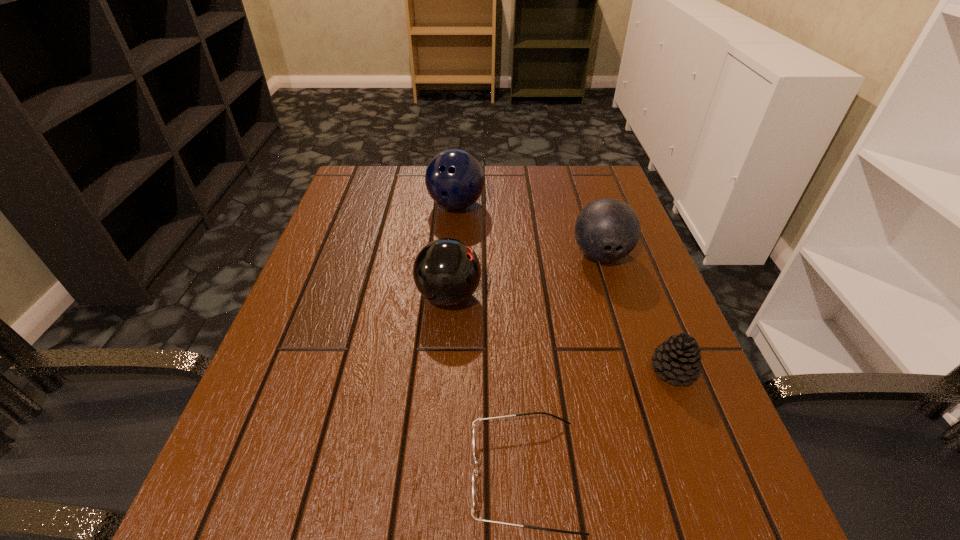
Identify the location of the farthest bowling ball. (455, 179).

You are a GUI agent. You are given a task and a screenshot of the screen. Output one action in this format:
    pyautogui.click(x=<x>, y=<y>)
    Task: Click on the rightmost bowling ball
    
    Given the screenshot: What is the action you would take?
    pyautogui.click(x=607, y=229)

Image resolution: width=960 pixels, height=540 pixels. Identify the location of the fourth farthest object. (678, 358).

Find the location of a particular element. The height and width of the screenshot is (540, 960). the fourth tallest object is located at coordinates (678, 358).

At what (x,y) coordinates should I click in order to perform the action: click on spectacles. Please return your answer as a coordinate pair (x, y). Looking at the image, I should click on coord(475,471).

The width and height of the screenshot is (960, 540). What are the coordinates of `the nearest object` in the screenshot? It's located at (475, 471).

The height and width of the screenshot is (540, 960). Find the location of `vacant space situated on the surface of the farthest object near the finger holes`. vacant space situated on the surface of the farthest object near the finger holes is located at coordinates (446, 345).

Where is `vacant space located on the grip area of the rightmost bowling ball`? vacant space located on the grip area of the rightmost bowling ball is located at coordinates (639, 374).

Locate an element on the screen. This screenshot has width=960, height=540. vacant space located at the narrow end of the pinecone is located at coordinates (430, 370).

Where is `free spot located 0.280m at the narrow end of the pinecone`? free spot located 0.280m at the narrow end of the pinecone is located at coordinates (492, 370).